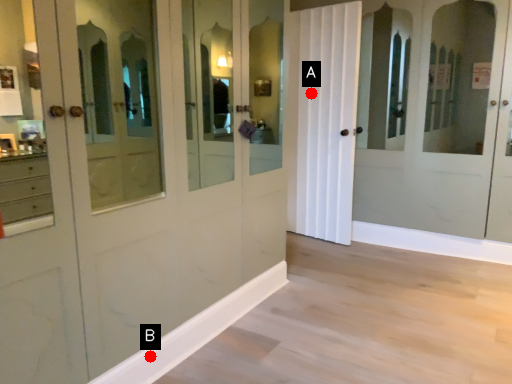
Question: Two points are circled on the image, labeled by A and B beside each circle. Which point appears farthest from the camera in this image?

Choices:
 (A) A is further
 (B) B is further

Answer: (A)